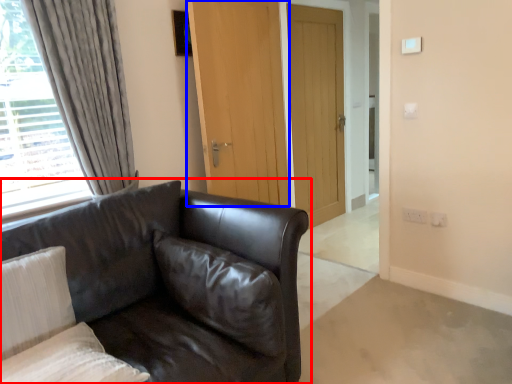
Question: Which object appears closest to the camera in this image, studio couch (highlighted by a red box) or door (highlighted by a blue box)?

Choices:
 (A) studio couch
 (B) door

Answer: (A)